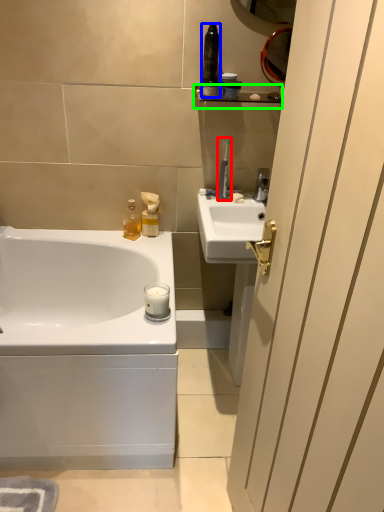
Question: Which is nearer to the toothbrush (highlighted by a red box)? toiletry (highlighted by a blue box) or balustrade (highlighted by a green box).

Choices:
 (A) toiletry
 (B) balustrade

Answer: (B)